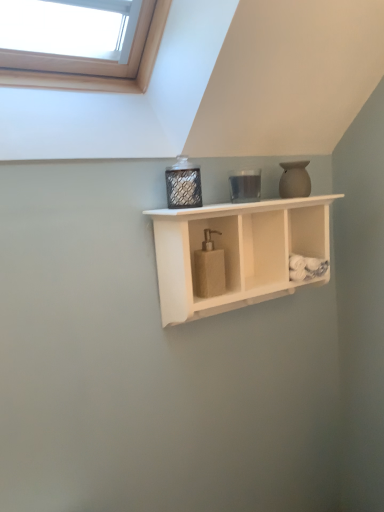
The height and width of the screenshot is (512, 384). What do you see at coordinates (209, 268) in the screenshot? I see `beige textured soap dispenser at center` at bounding box center [209, 268].

Where is `matte beige vase at upper right`? matte beige vase at upper right is located at coordinates (294, 180).

Locate an element on the screen. white matte wood shelf at center is located at coordinates (238, 252).

Is beige textured soap dispenser at center a part of white matte wood shelf at center?

That's correct, beige textured soap dispenser at center is inside white matte wood shelf at center.

Would you say white matte wood shelf at center is a long distance from beige textured soap dispenser at center?

No, white matte wood shelf at center is not far away from beige textured soap dispenser at center.

Does white matte wood shelf at center turn towards beige textured soap dispenser at center?

Yes.

Identify the location of soap dispenser located above the white matte wood shelf at center (from a real-world perspective). (209, 268).

This screenshot has width=384, height=512. I want to click on vase above the beige textured soap dispenser at center (from a real-world perspective), so click(x=294, y=180).

Is beige textured soap dispenser at center inside the boundaries of matte beige vase at upper right, or outside?

beige textured soap dispenser at center is not enclosed by matte beige vase at upper right.

Is beige textured soap dispenser at center positioned in front of matte beige vase at upper right?

Yes, it is in front of matte beige vase at upper right.

Is beige textured soap dispenser at center at the left side of matte beige vase at upper right?

Correct, you'll find beige textured soap dispenser at center to the left of matte beige vase at upper right.

From the image's perspective, which is below, white matte wood shelf at center or matte beige vase at upper right?

white matte wood shelf at center is shown below in the image.

Considering the sizes of objects white matte wood shelf at center and matte beige vase at upper right in the image provided, who is bigger, white matte wood shelf at center or matte beige vase at upper right?

white matte wood shelf at center.

Is white matte wood shelf at center spatially inside matte beige vase at upper right, or outside of it?

white matte wood shelf at center exists outside the volume of matte beige vase at upper right.

Can you confirm if white matte wood shelf at center is thinner than matte beige vase at upper right?

Incorrect, the width of white matte wood shelf at center is not less than that of matte beige vase at upper right.

Is metallic mesh container at center facing towards matte beige vase at upper right?

No, metallic mesh container at center is not turned towards matte beige vase at upper right.

Can you tell me how much metallic mesh container at center and matte beige vase at upper right differ in facing direction?

The angular difference between metallic mesh container at center and matte beige vase at upper right is 0.000172 degrees.

From a real-world perspective, who is located higher, metallic mesh container at center or matte beige vase at upper right?

In real-world perspective, metallic mesh container at center is above.

Does metallic mesh container at center have a greater height compared to matte beige vase at upper right?

In fact, metallic mesh container at center may be shorter than matte beige vase at upper right.

What's the angular difference between metallic mesh container at center and white matte wood shelf at center's facing directions?

The angular difference between metallic mesh container at center and white matte wood shelf at center is 0.000792 degrees.

Consider the image. From the image's perspective, does metallic mesh container at center appear lower than white matte wood shelf at center?

Actually, metallic mesh container at center appears above white matte wood shelf at center in the image.

Considering the relative sizes of metallic mesh container at center and white matte wood shelf at center in the image provided, is metallic mesh container at center shorter than white matte wood shelf at center?

Indeed, metallic mesh container at center has a lesser height compared to white matte wood shelf at center.

Is metallic mesh container at center positioned with its back to white matte wood shelf at center?

That's not correct — metallic mesh container at center is not looking away from white matte wood shelf at center.

From a real-world perspective, is matte beige vase at upper right physically located above or below beige textured soap dispenser at center?

From a real-world perspective, matte beige vase at upper right is physically above beige textured soap dispenser at center.

Considering the sizes of objects matte beige vase at upper right and beige textured soap dispenser at center in the image provided, who is smaller, matte beige vase at upper right or beige textured soap dispenser at center?

matte beige vase at upper right is smaller.

Is matte beige vase at upper right closer to the viewer compared to beige textured soap dispenser at center?

No, matte beige vase at upper right is further to the viewer.

Find the location of a particular element. This screenshot has width=384, height=512. vase on the right of the beige textured soap dispenser at center is located at coordinates (294, 180).

Which of these two, beige textured soap dispenser at center or white matte wood shelf at center, is smaller?

beige textured soap dispenser at center.

Which is correct: beige textured soap dispenser at center is inside white matte wood shelf at center, or outside of it?

beige textured soap dispenser at center is inside white matte wood shelf at center.

From the image's perspective, is beige textured soap dispenser at center below white matte wood shelf at center?

Yes, from the image's perspective, beige textured soap dispenser at center is beneath white matte wood shelf at center.

Is beige textured soap dispenser at center in front of white matte wood shelf at center?

No, beige textured soap dispenser at center is further to the viewer.

Locate an element on the screen. soap dispenser to the left of white matte wood shelf at center is located at coordinates (209, 268).

Where is `vase above the beige textured soap dispenser at center (from a real-world perspective)`? This screenshot has height=512, width=384. vase above the beige textured soap dispenser at center (from a real-world perspective) is located at coordinates (294, 180).

Looking at the image, which one is located further to white matte wood shelf at center, matte beige vase at upper right or beige textured soap dispenser at center?

Among the two, matte beige vase at upper right is located further to white matte wood shelf at center.

Based on their spatial positions, is white matte wood shelf at center or beige textured soap dispenser at center closer to matte beige vase at upper right?

white matte wood shelf at center is closer to matte beige vase at upper right.

When comparing their distances from white matte wood shelf at center, does matte beige vase at upper right or metallic mesh container at center seem further?

Based on the image, matte beige vase at upper right appears to be further to white matte wood shelf at center.

Considering their positions, is beige textured soap dispenser at center positioned closer to matte beige vase at upper right than white matte wood shelf at center?

Based on the image, white matte wood shelf at center appears to be nearer to matte beige vase at upper right.

Which object lies nearer to the anchor point metallic mesh container at center, white matte wood shelf at center or beige textured soap dispenser at center?

beige textured soap dispenser at center is closer to metallic mesh container at center.

Which object lies nearer to the anchor point metallic mesh container at center, beige textured soap dispenser at center or matte beige vase at upper right?

The object closer to metallic mesh container at center is beige textured soap dispenser at center.

Which object lies further to the anchor point matte beige vase at upper right, white matte wood shelf at center or metallic mesh container at center?

metallic mesh container at center is further to matte beige vase at upper right.

Considering their positions, is matte beige vase at upper right positioned further to metallic mesh container at center than beige textured soap dispenser at center?

matte beige vase at upper right lies further to metallic mesh container at center than the other object.

Where is `shelf between matte beige vase at upper right and beige textured soap dispenser at center vertically`? This screenshot has height=512, width=384. shelf between matte beige vase at upper right and beige textured soap dispenser at center vertically is located at coordinates (238, 252).

At what (x,y) coordinates should I click in order to perform the action: click on shelf between metallic mesh container at center and matte beige vase at upper right in the horizontal direction. Please return your answer as a coordinate pair (x, y). Looking at the image, I should click on (238, 252).

This screenshot has width=384, height=512. Identify the location of soap dispenser between metallic mesh container at center and matte beige vase at upper right from left to right. (209, 268).

Where is `shelf between metallic mesh container at center and beige textured soap dispenser at center in the vertical direction`? The width and height of the screenshot is (384, 512). shelf between metallic mesh container at center and beige textured soap dispenser at center in the vertical direction is located at coordinates (238, 252).